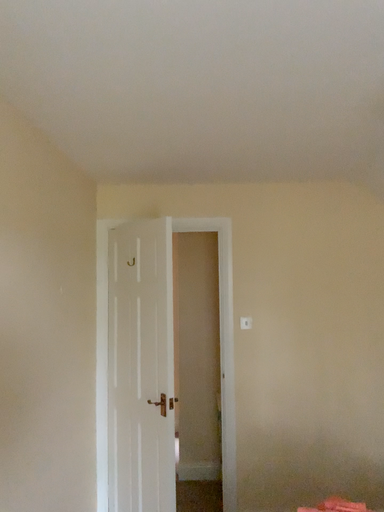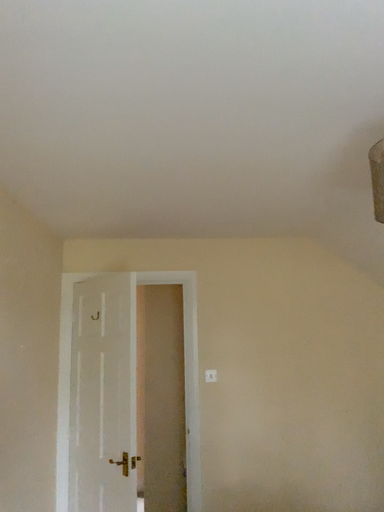
Question: How did the camera likely rotate when shooting the video?

Choices:
 (A) rotated downward
 (B) rotated upward

Answer: (B)